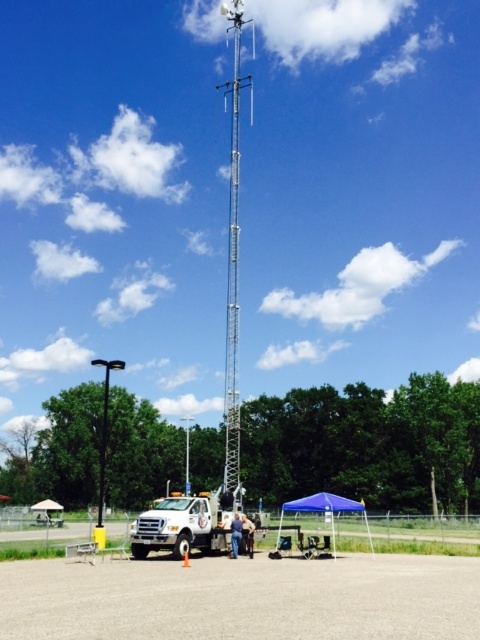
Question: Which point appears closest to the camera in this image?

Choices:
 (A) (228, 426)
 (B) (230, 534)
 (C) (164, 518)

Answer: (C)

Question: Which point is farther to the camera?

Choices:
 (A) (238, 403)
 (B) (236, 545)
 (C) (168, 548)
 (D) (98, 515)

Answer: (A)

Question: Is silver metallic antenna at center bigger than white matte truck at lower center?

Choices:
 (A) no
 (B) yes

Answer: (B)

Question: Can you confirm if white matte truck at lower center is smaller than blue jeans at center?

Choices:
 (A) no
 (B) yes

Answer: (A)

Question: Which point is farther to the camera?

Choices:
 (A) (212, 531)
 (B) (237, 516)
 (C) (236, 326)
 (D) (107, 388)

Answer: (D)

Question: Is black metal pole at left bigger than blue jeans at center?

Choices:
 (A) no
 (B) yes

Answer: (B)